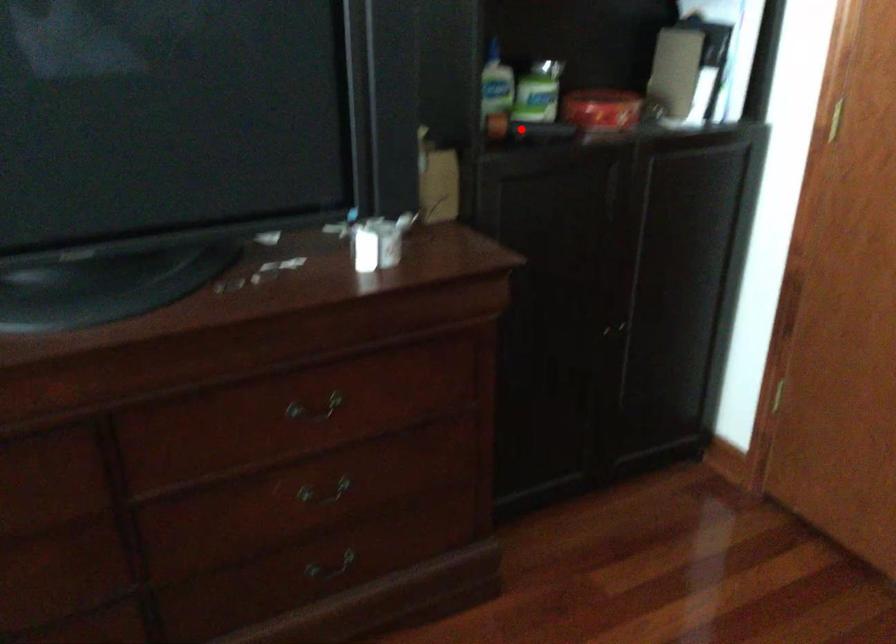
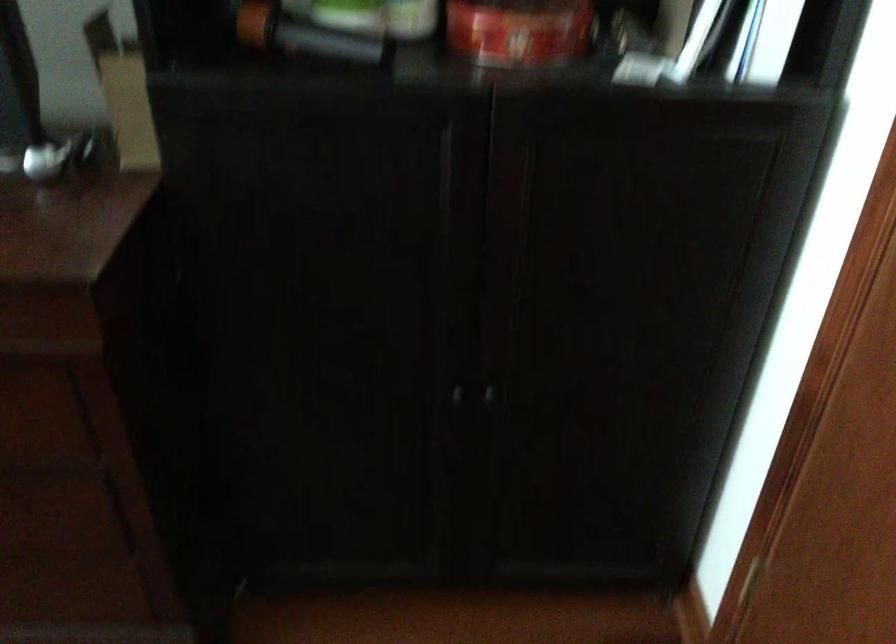
Locate, in the second image, the point that corresponds to the highlighted location in the first image.

(304, 35)